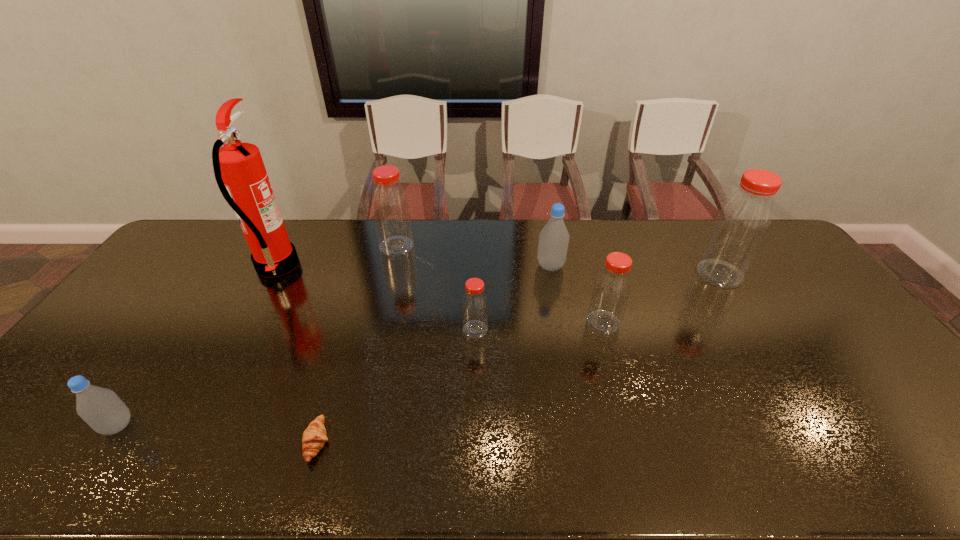
This screenshot has height=540, width=960. I want to click on fire extinguisher, so click(x=239, y=170).

Identify the location of the tallest object. Image resolution: width=960 pixels, height=540 pixels. (239, 170).

This screenshot has width=960, height=540. I want to click on the biggest red bottle, so click(743, 221).

Image resolution: width=960 pixels, height=540 pixels. What are the coordinates of `the tallest bottle` in the screenshot? It's located at (743, 221).

The image size is (960, 540). I want to click on the fifth bottle from right to left, so click(390, 205).

At what (x,y) coordinates should I click in order to perform the action: click on the sixth shortest object. Please return your answer as a coordinate pair (x, y). The width and height of the screenshot is (960, 540). Looking at the image, I should click on (390, 205).

Find the location of a particular element. the third bottle from right to left is located at coordinates pos(553,243).

Where is `the right gray bottle`? the right gray bottle is located at coordinates (553, 243).

Identify the location of the second object from right to left. (612, 287).

This screenshot has height=540, width=960. I want to click on the second bottle from right to left, so click(612, 287).